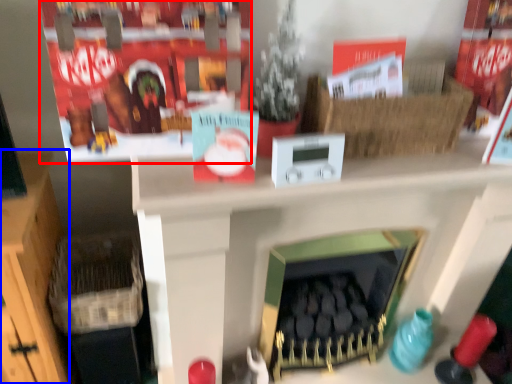
Question: Which point is further to the camera, shelf (highlighted by a red box) or furniture (highlighted by a blue box)?

Choices:
 (A) shelf
 (B) furniture

Answer: (B)